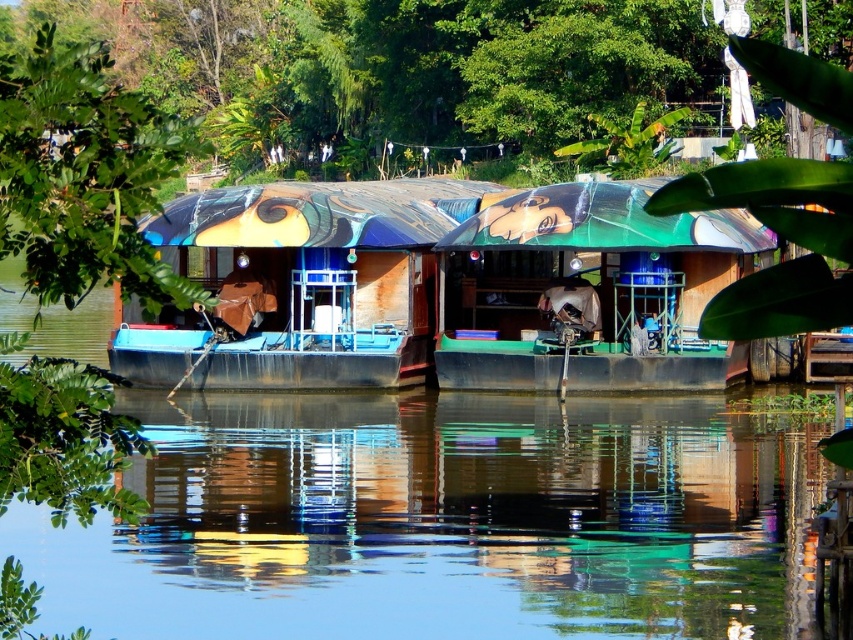
What do you see at coordinates (445, 520) in the screenshot? I see `transparent water at center` at bounding box center [445, 520].

Can you confirm if transparent water at center is bigger than green matte boat at center?

Correct, transparent water at center is larger in size than green matte boat at center.

You are a GUI agent. You are given a task and a screenshot of the screen. Output one action in this format:
    pyautogui.click(x=<x>, y=<y>)
    Task: Click on the transparent water at center
    This screenshot has width=853, height=640.
    Given the screenshot: What is the action you would take?
    pyautogui.click(x=445, y=520)

Does point (347, 262) lie behind point (618, 234)?

Yes, point (347, 262) is farther from viewer.

Which of these two, matte blue boat at center or green matte boat at center, stands taller?

matte blue boat at center

Does point (344, 268) lie in front of point (643, 221)?

That is False.

You are a GUI agent. You are given a task and a screenshot of the screen. Output one action in this format:
    pyautogui.click(x=<x>, y=<y>)
    Task: Click on the matte blue boat at center
    The height and width of the screenshot is (640, 853).
    Given the screenshot: What is the action you would take?
    pyautogui.click(x=297, y=285)

Is transparent water at center to the left of matte blue boat at center from the viewer's perspective?

In fact, transparent water at center is to the right of matte blue boat at center.

In the scene shown: Is transparent water at center taller than matte blue boat at center?

No, transparent water at center is not taller than matte blue boat at center.

Between point (363, 550) and point (233, 339), which one is positioned in front?

Point (363, 550)

I want to click on transparent water at center, so click(x=445, y=520).